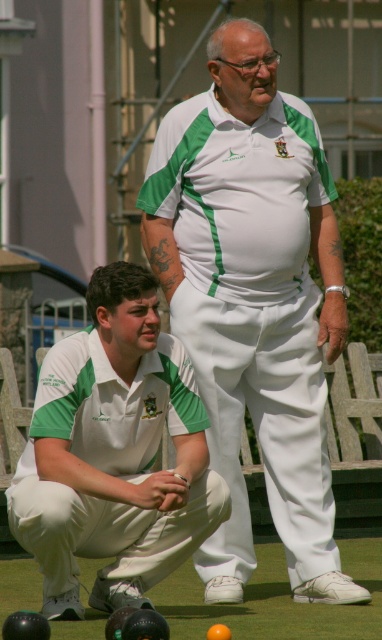
Is point (213, 108) positioned in front of point (129, 276)?

No, (213, 108) is further to viewer.

Does white cotton shirt at center appear under white cotton squat at lower left?

No, white cotton shirt at center is not below white cotton squat at lower left.

Is point (268, 339) closer to viewer compared to point (126, 476)?

No, (268, 339) is further to viewer.

Locate an element on the screen. This screenshot has width=382, height=640. white cotton shirt at center is located at coordinates (254, 300).